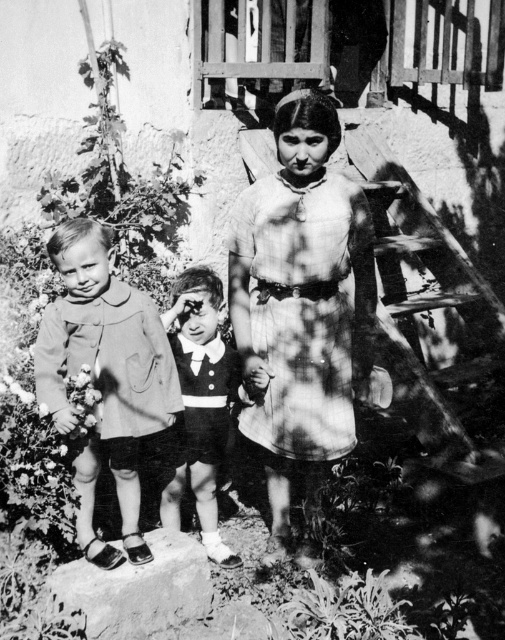
Question: Which object is positioned closest to the matte brown coat at left?

Choices:
 (A) plaid fabric dress at center
 (B) white fluffy flower at lower left
 (C) smooth black suit at center

Answer: (B)

Question: Which object is positioned farthest from the smooth black suit at center?

Choices:
 (A) plaid fabric dress at center
 (B) smooth gray stone at lower center

Answer: (B)

Question: Is plaid fabric dress at center wider than smooth black suit at center?

Choices:
 (A) yes
 (B) no

Answer: (A)

Question: Which of the following is the closest to the observer?

Choices:
 (A) smooth black suit at center
 (B) smooth gray stone at lower center
 (C) white fluffy flower at lower left
 (D) plaid fabric dress at center

Answer: (D)

Question: In this image, where is plaid fabric dress at center located relative to white fluffy flower at lower left?

Choices:
 (A) below
 (B) above

Answer: (B)

Question: Does plaid fabric dress at center have a greater width compared to matte brown coat at left?

Choices:
 (A) no
 (B) yes

Answer: (B)